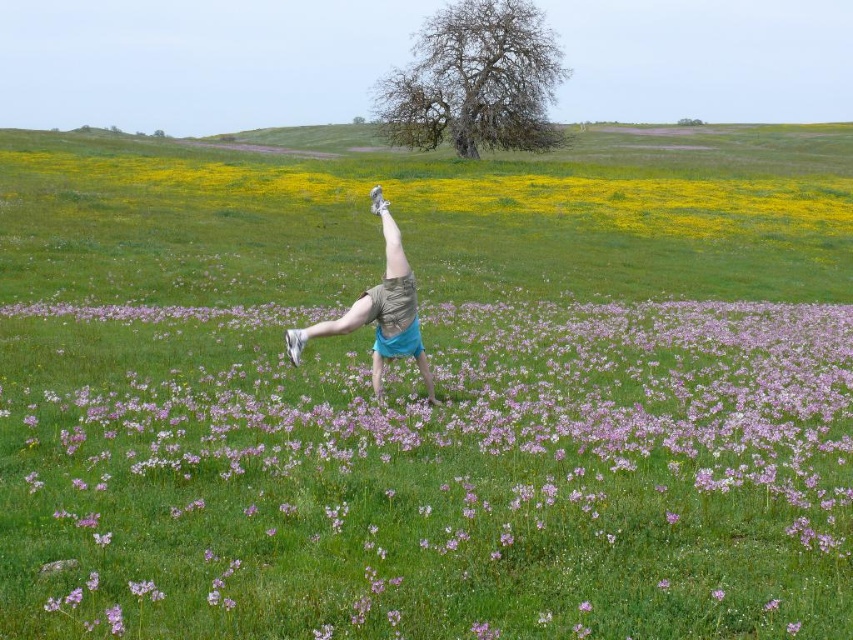
Question: Is purple matte flower at center smaller than yellow matte flower at upper center?

Choices:
 (A) yes
 (B) no

Answer: (A)

Question: Is purple matte flower at center positioned at the back of yellow matte flower at upper center?

Choices:
 (A) no
 (B) yes

Answer: (A)

Question: Is purple matte flower at center in front of yellow matte flower at upper center?

Choices:
 (A) no
 (B) yes

Answer: (B)

Question: Which object is closer to the camera taking this photo?

Choices:
 (A) light blue shorts at center
 (B) yellow matte flower at upper center
 (C) purple matte flower at center

Answer: (C)

Question: Which of the following is the closest to the observer?

Choices:
 (A) purple matte flower at center
 (B) light blue shorts at center

Answer: (A)

Question: Which of the following is the farthest from the observer?

Choices:
 (A) yellow matte flower at upper center
 (B) purple matte flower at center

Answer: (A)